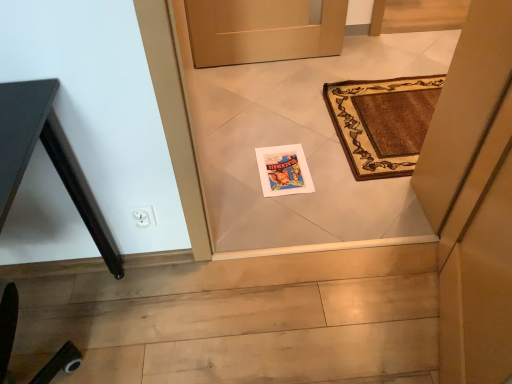
Find the location of a particular element. The height and width of the screenshot is (384, 512). vacant area on top of matte paper postcard at center (from a real-world perspective) is located at coordinates coord(281,160).